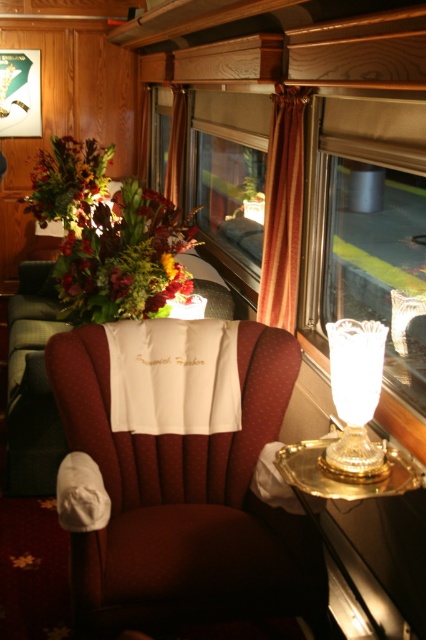
Does gold metallic tray at lower right appear over orange fabric curtain at upper center?

Incorrect, gold metallic tray at lower right is not positioned above orange fabric curtain at upper center.

In the scene shown: Which is below, gold metallic tray at lower right or orange fabric curtain at upper center?

gold metallic tray at lower right is below.

Which is in front, point (388, 486) or point (141, 100)?

Point (388, 486) is more forward.

The height and width of the screenshot is (640, 426). Find the location of `gold metallic tray at lower right`. gold metallic tray at lower right is located at coordinates (342, 492).

Which is more to the left, orange velvet curtain at center or gold metallic tray at lower right?

Positioned to the left is orange velvet curtain at center.

Is orange velvet curtain at center above gold metallic tray at lower right?

Yes.

Is point (276, 308) positioned before point (293, 483)?

That is False.

Identify the location of orange velvet curtain at center. The image size is (426, 640). (282, 209).

Is transparent glass vase at right smaller than multicolored floral arrangement at left?

Indeed, transparent glass vase at right has a smaller size compared to multicolored floral arrangement at left.

Does point (414, 273) come farther from viewer compared to point (37, 193)?

No.

The image size is (426, 640). What do you see at coordinates (379, 264) in the screenshot?
I see `transparent glass vase at right` at bounding box center [379, 264].

Image resolution: width=426 pixels, height=640 pixels. Find the location of `transparent glass vase at right`. transparent glass vase at right is located at coordinates (379, 264).